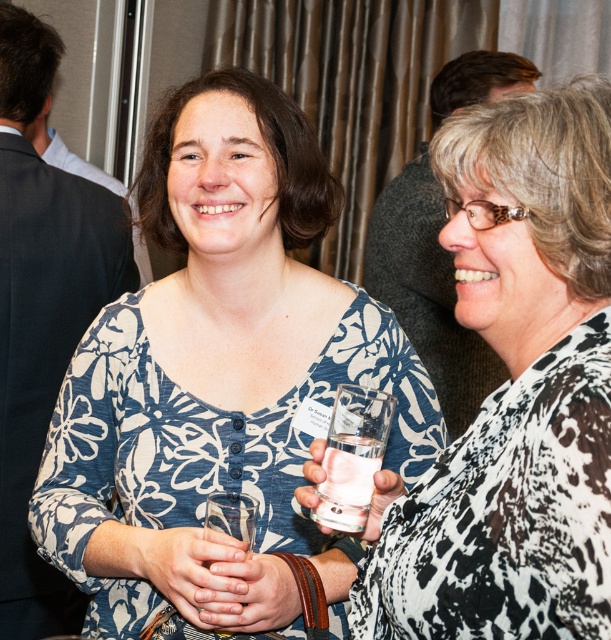
You are a photographer at the event and want to take a photo of both women. However, you notice that the white glossy glass at center and the clear glass at center might block the view. Which glass should you move to ensure both women are fully visible in the photo?

The white glossy glass at center is in front of the clear glass at center, so moving the white glossy glass at center would allow the clear glass at center to not block the view, ensuring both women are fully visible.

You are a bartender at a party and need to serve drinks to two guests. The guest on the left is holding a white glossy glass at center, and the guest on the right is holding a clear glass at center. Which guest should you pour the drink into first if you want to avoid spillage due to glass height differences?

You should pour the drink into the clear glass at center first because it is shorter than the white glossy glass at center. Pouring into the shorter glass first allows you to monitor the liquid level more easily and reduces the risk of overflow when pouring into the taller glass later.